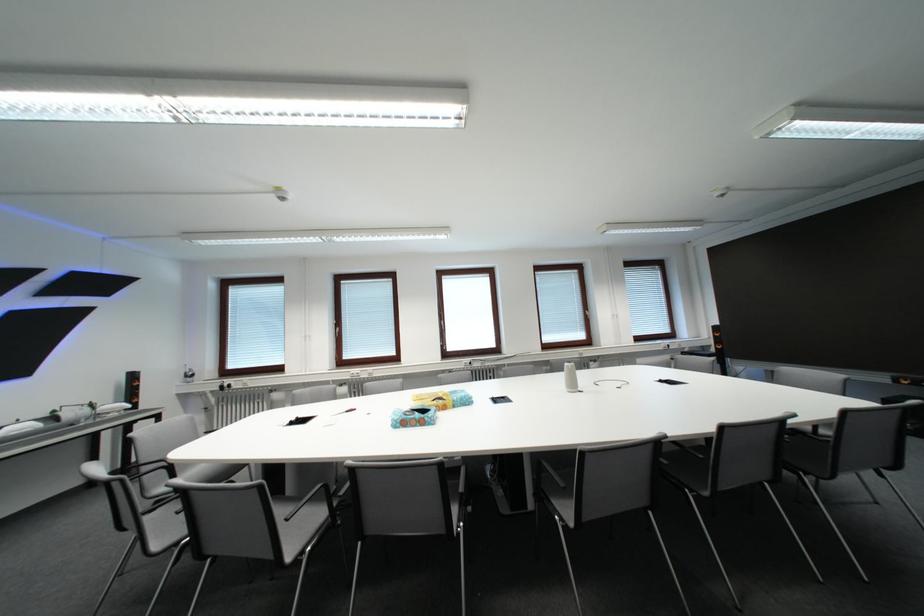
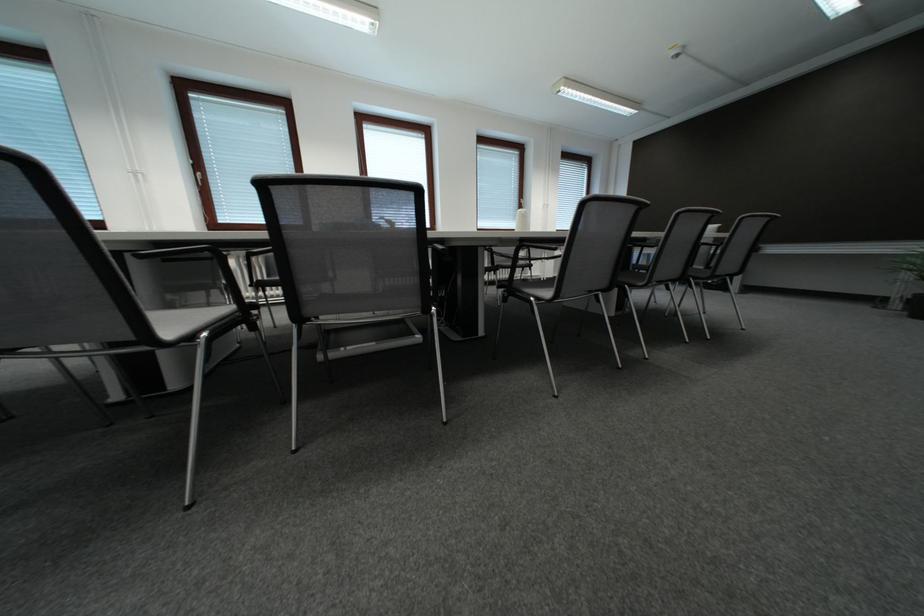
The images are taken continuously from a first-person perspective. In which direction are you moving?

The movement direction of the cameraman is left, forward.